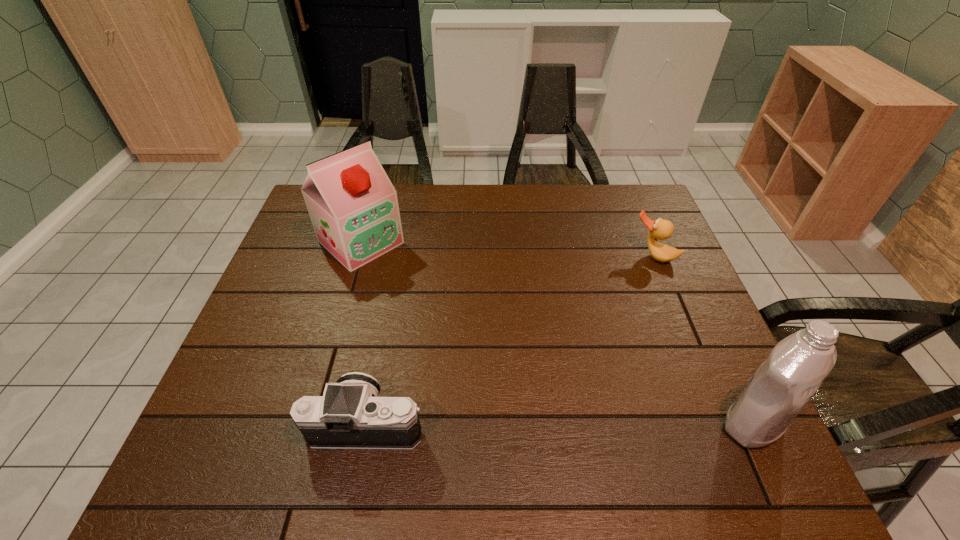
Locate an element on the screen. The image size is (960, 540). free region at the far edge of the desktop is located at coordinates (575, 214).

You are a GUI agent. You are given a task and a screenshot of the screen. Output one action in this format:
    pyautogui.click(x=<x>, y=<y>)
    Task: Click on the vacant space at the near edge of the desktop
    The width and height of the screenshot is (960, 540).
    Given the screenshot: What is the action you would take?
    pyautogui.click(x=529, y=415)

The image size is (960, 540). In order to click on vacant space at the left edge in this screenshot , I will do `click(310, 325)`.

Locate an element on the screen. The width and height of the screenshot is (960, 540). free space at the right edge is located at coordinates (648, 278).

Find the location of `free space at the far left corner of the desktop`. free space at the far left corner of the desktop is located at coordinates tap(299, 222).

This screenshot has width=960, height=540. What are the coordinates of `vacant area between the detergent and the duck` in the screenshot? It's located at (703, 339).

You are a GUI agent. You are given a task and a screenshot of the screen. Output one action in this format:
    pyautogui.click(x=<x>, y=<y>)
    Task: Click on the vacant space in between the camera and the duck
    The width and height of the screenshot is (960, 540).
    Given the screenshot: What is the action you would take?
    pyautogui.click(x=511, y=340)

Locate an element on the screen. vacant area that lies between the camera and the detergent is located at coordinates (560, 423).

Where is `vacant space that is in between the detergent and the soya milk`? The width and height of the screenshot is (960, 540). vacant space that is in between the detergent and the soya milk is located at coordinates (557, 333).

Locate an element on the screen. This screenshot has height=540, width=960. vacant space in between the duck and the soya milk is located at coordinates (507, 249).